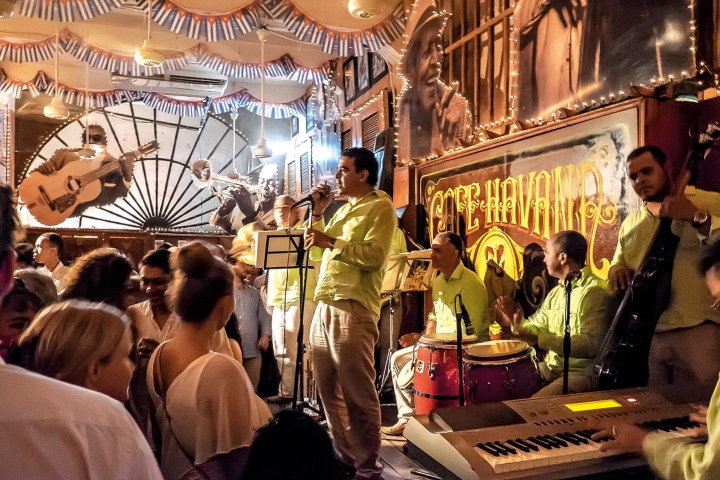
Locate an element on the screen. Image resolution: width=720 pixels, height=480 pixels. piano is located at coordinates (549, 463).